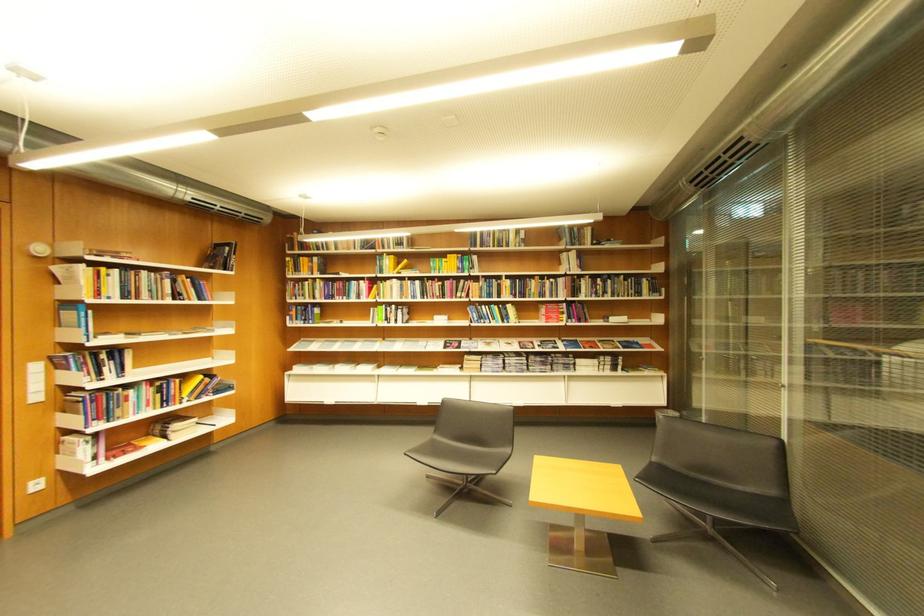
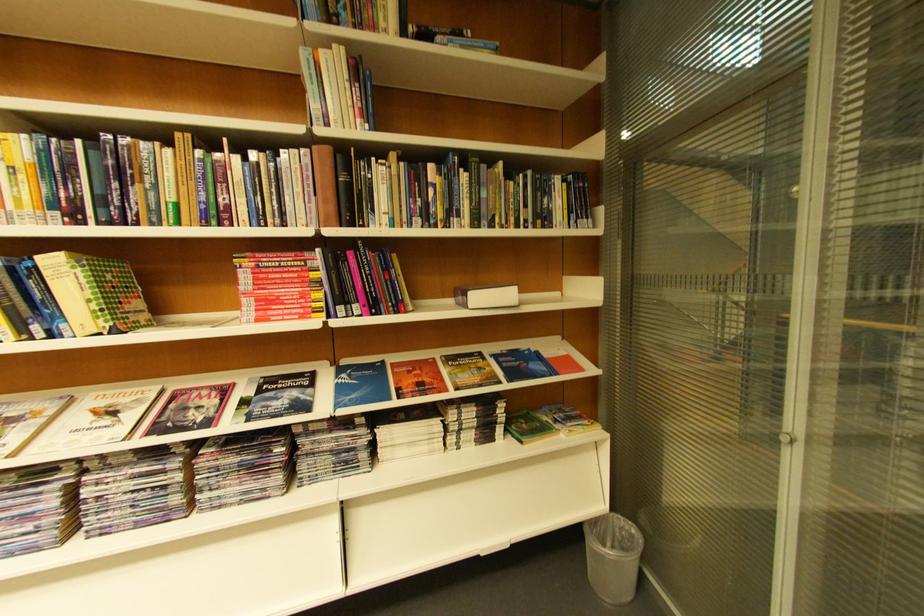
Find the pixel in the second image that matches (x=561, y=308) in the first image.

(281, 262)